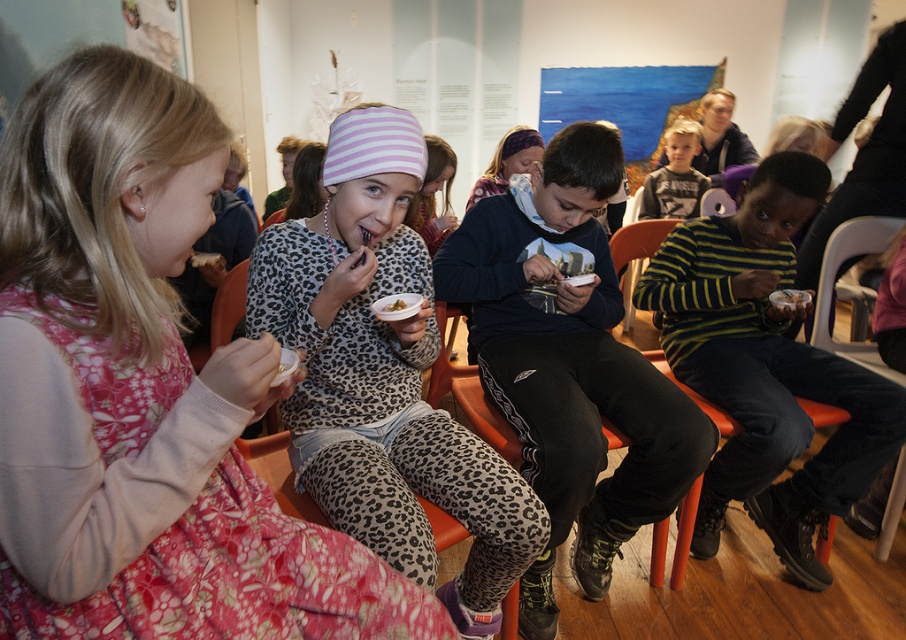
Question: Which of the following is the farthest from the observer?

Choices:
 (A) [634, 284]
 (B) [195, 420]

Answer: (A)

Question: Is leopard print sweater at center smaller than white plastic chair at lower right?

Choices:
 (A) yes
 (B) no

Answer: (B)

Question: Can you confirm if white plastic chair at lower right is positioned below orange plastic chair at right?

Choices:
 (A) no
 (B) yes

Answer: (B)

Question: Which object is positioned farthest from the green leafy salad at center?

Choices:
 (A) leopard print sweater at center
 (B) orange plastic chair at right

Answer: (B)

Question: In this image, where is leopard print sweater at center located relative to striped knit hat at upper center?

Choices:
 (A) above
 (B) below

Answer: (B)

Question: Among these points, which one is farthest from the camera?

Choices:
 (A) (818, 326)
 (B) (672, 200)
 (C) (624, 234)

Answer: (B)